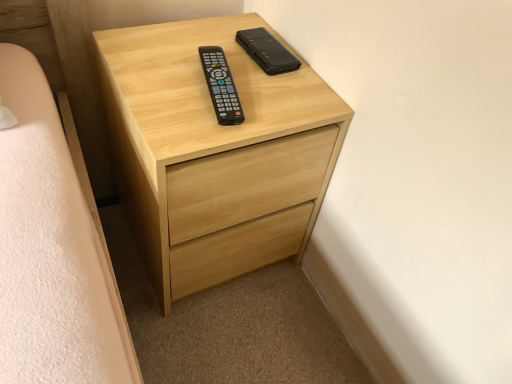
Question: Is light wood chest of drawers at center situated inside black leather phone case at upper center, positioned as the first control in back-to-front order, or outside?

Choices:
 (A) outside
 (B) inside

Answer: (A)

Question: From the image's perspective, is light wood chest of drawers at center located above or below black leather phone case at upper center, positioned as the first control in back-to-front order?

Choices:
 (A) above
 (B) below

Answer: (B)

Question: Considering the real-world distances, which object is farthest from the light wood chest of drawers at center?

Choices:
 (A) black plastic remote at center, which is counted as the 1th control, starting from the front
 (B) black leather phone case at upper center, positioned as the 2th control in front-to-back order

Answer: (B)

Question: Which of these objects is positioned closest to the light wood chest of drawers at center?

Choices:
 (A) black plastic remote at center, the second control viewed from the back
 (B) black leather phone case at upper center, positioned as the first control in back-to-front order

Answer: (A)